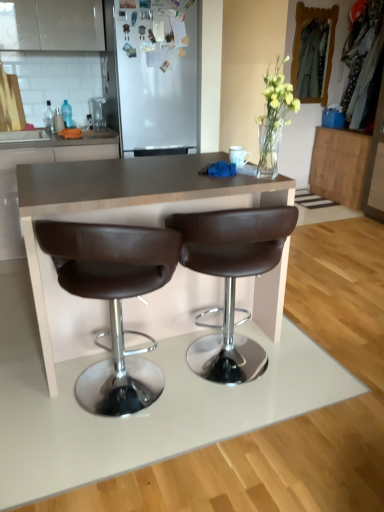
Find the location of `vacant area situated to the left side of brown leather stool at center, acting as the second chair starting from the right`. vacant area situated to the left side of brown leather stool at center, acting as the second chair starting from the right is located at coordinates (24, 390).